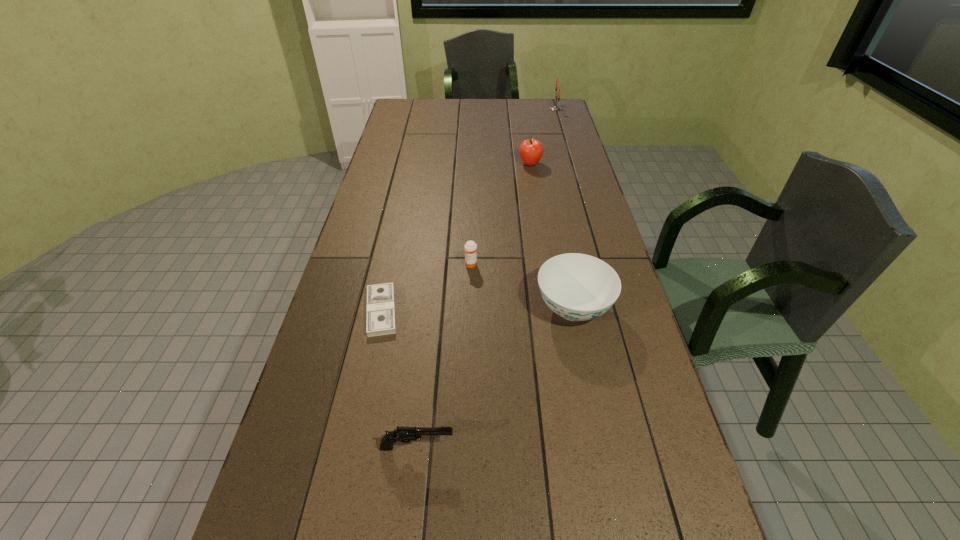
The width and height of the screenshot is (960, 540). Find the location of `chinaware present at the right edge`. chinaware present at the right edge is located at coordinates (578, 287).

Image resolution: width=960 pixels, height=540 pixels. What are the coordinates of `object present at the far right corner` in the screenshot? It's located at (554, 108).

What are the coordinates of `vacant space at the far edge` in the screenshot? It's located at (477, 119).

Find the location of a particular element. free space at the left edge is located at coordinates (417, 153).

This screenshot has width=960, height=540. I want to click on vacant area at the right edge, so click(555, 167).

Identify the location of free space between the dollar and the fourth nearest object. (426, 288).

Where is `vacant space that's between the chinaware and the gun`? This screenshot has height=540, width=960. vacant space that's between the chinaware and the gun is located at coordinates (495, 377).

Locate an element on the screen. vacant region between the chinaware and the dollar is located at coordinates (477, 309).

Where is `vacant area that lies between the dollar and the third farthest object`? This screenshot has height=540, width=960. vacant area that lies between the dollar and the third farthest object is located at coordinates pos(426,288).

You are a GUI agent. You are given a task and a screenshot of the screen. Output one action in this format:
    pyautogui.click(x=<x>, y=<y>)
    Task: Click on the free area in between the medicine and the candle
    
    Given the screenshot: What is the action you would take?
    pyautogui.click(x=513, y=187)